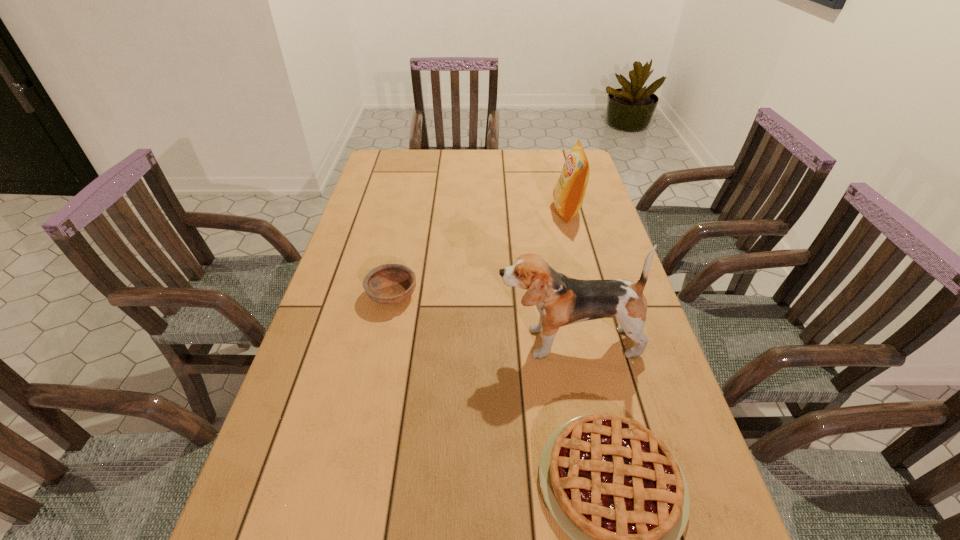
Find the location of a particular element. The image size is (960, 540). vacant point located on the front-facing side of the crisp (potato chip) is located at coordinates (492, 211).

Where is `vacant space located on the front-facing side of the crisp (potato chip)`? This screenshot has height=540, width=960. vacant space located on the front-facing side of the crisp (potato chip) is located at coordinates [462, 211].

Locate an element on the screen. Image resolution: width=960 pixels, height=540 pixels. free spot located on the back of the bowl is located at coordinates (403, 244).

Where is `object at the left edge`? This screenshot has height=540, width=960. object at the left edge is located at coordinates (389, 284).

The height and width of the screenshot is (540, 960). I want to click on puppy positioned at the right edge, so click(561, 300).

Locate an element on the screen. This screenshot has width=960, height=540. crisp (potato chip) that is positioned at the right edge is located at coordinates (568, 195).

At what (x,y) coordinates should I click in order to perform the action: click on vacant position at the far edge of the desktop. Please return your answer as a coordinate pair (x, y). This screenshot has width=960, height=540. Looking at the image, I should click on [x=449, y=156].

This screenshot has height=540, width=960. In order to click on free space at the left edge in this screenshot , I will do `click(343, 327)`.

The width and height of the screenshot is (960, 540). What are the coordinates of `free space at the right edge of the desktop` in the screenshot? It's located at (609, 222).

In the image, there is a desktop. Where is `free region at the far left corner`? free region at the far left corner is located at coordinates (401, 152).